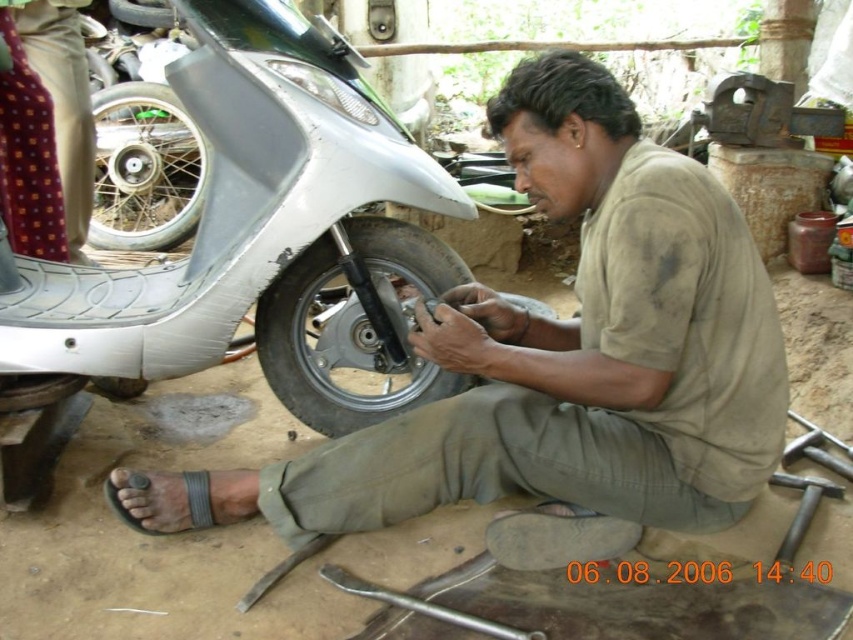
Question: Is white matte motorcycle at center thinner than silver wire-spoke wheel at left?

Choices:
 (A) no
 (B) yes

Answer: (A)

Question: Considering the real-world distances, which object is closest to the brown cotton shirt at center?

Choices:
 (A) white matte motorcycle at center
 (B) black rubber tire at center

Answer: (B)

Question: Does brown cotton shirt at center appear on the right side of white matte motorcycle at center?

Choices:
 (A) yes
 (B) no

Answer: (A)

Question: Among these points, which one is farthest from the camera?

Choices:
 (A) (59, 83)
 (B) (554, 502)
 (C) (165, 116)
 (D) (412, 227)

Answer: (C)

Question: Based on their relative distances, which object is farther from the black rubber tire at center?

Choices:
 (A) white matte motorcycle at center
 (B) polka dot fabric at upper left

Answer: (B)

Question: Can you confirm if brown cotton shirt at center is thinner than black rubber tire at center?

Choices:
 (A) no
 (B) yes

Answer: (A)